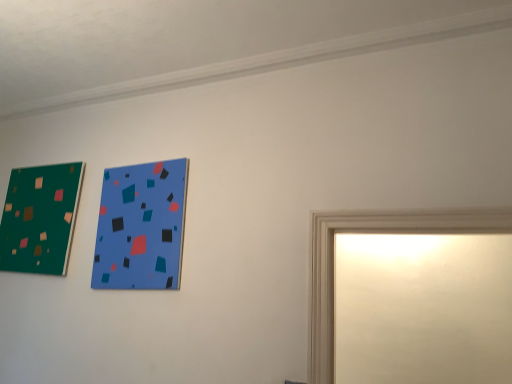
Question: Considering the relative positions of matte green picture frame at upper left, the second picture frame positioned from the front, and blue matte picture frame at upper center, the 2th picture frame viewed from the back, in the image provided, is matte green picture frame at upper left, the second picture frame positioned from the front, to the left or to the right of blue matte picture frame at upper center, the 2th picture frame viewed from the back,?

Choices:
 (A) right
 (B) left

Answer: (B)

Question: Is point (57, 190) closer or farther from the camera than point (133, 190)?

Choices:
 (A) farther
 (B) closer

Answer: (A)

Question: Is matte green picture frame at upper left, the 1th picture frame viewed from the back, bigger or smaller than blue matte picture frame at upper center, marked as the 1th picture frame in a front-to-back arrangement?

Choices:
 (A) small
 (B) big

Answer: (B)

Question: Is blue matte picture frame at upper center, the 2th picture frame viewed from the back, in front of or behind matte green picture frame at upper left, placed as the 1th picture frame when sorted from left to right, in the image?

Choices:
 (A) front
 (B) behind

Answer: (A)

Question: Is point (148, 208) closer or farther from the camera than point (50, 203)?

Choices:
 (A) closer
 (B) farther

Answer: (A)

Question: Is blue matte picture frame at upper center, the 1th picture frame positioned from the right, inside or outside of matte green picture frame at upper left, the second picture frame in the right-to-left sequence?

Choices:
 (A) inside
 (B) outside

Answer: (B)

Question: Considering the relative positions of blue matte picture frame at upper center, marked as the 1th picture frame in a front-to-back arrangement, and matte green picture frame at upper left, the second picture frame in the right-to-left sequence, in the image provided, is blue matte picture frame at upper center, marked as the 1th picture frame in a front-to-back arrangement, to the left or to the right of matte green picture frame at upper left, the second picture frame in the right-to-left sequence,?

Choices:
 (A) right
 (B) left

Answer: (A)